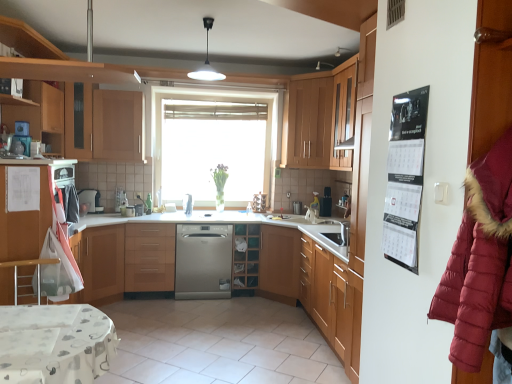
Question: From a real-world perspective, does satin silver dishwasher at center, the fourth appliance when ordered from back to front, stand above wooden cabinet at upper right, marked as the first cabinetry in a right-to-left arrangement?

Choices:
 (A) yes
 (B) no

Answer: (B)

Question: Would you say satin silver dishwasher at center, the first appliance viewed from the left, is a long distance from wooden cabinet at upper right, which appears as the fifth cabinetry when viewed from the left?

Choices:
 (A) no
 (B) yes

Answer: (B)

Question: Can you confirm if satin silver dishwasher at center, the first appliance viewed from the left, is taller than wooden cabinet at upper right, which appears as the fifth cabinetry when viewed from the left?

Choices:
 (A) no
 (B) yes

Answer: (A)

Question: Is satin silver dishwasher at center, which is counted as the 1th appliance, starting from the front, in contact with wooden cabinet at upper right, which appears as the fifth cabinetry when viewed from the left?

Choices:
 (A) no
 (B) yes

Answer: (A)

Question: Does satin silver dishwasher at center, the first appliance viewed from the left, have a smaller size compared to wooden cabinet at upper right, which appears as the fifth cabinetry when viewed from the left?

Choices:
 (A) no
 (B) yes

Answer: (B)

Question: Is satin silver dishwasher at center, which is counted as the 1th appliance, starting from the front, facing towards wooden cabinet at upper right, which appears as the fifth cabinetry when viewed from the left?

Choices:
 (A) no
 (B) yes

Answer: (B)

Question: Is metallic silver bar stool at lower left further to the viewer compared to wooden cabinet at upper center, which is the 2th cabinetry from right to left?

Choices:
 (A) no
 (B) yes

Answer: (A)

Question: Is metallic silver bar stool at lower left positioned before wooden cabinet at upper center, which is the 2th cabinetry from right to left?

Choices:
 (A) yes
 (B) no

Answer: (A)

Question: Would you say metallic silver bar stool at lower left is a long distance from wooden cabinet at upper center, the fourth cabinetry when ordered from left to right?

Choices:
 (A) no
 (B) yes

Answer: (B)

Question: From the image's perspective, is metallic silver bar stool at lower left below wooden cabinet at upper center, which is the 2th cabinetry from right to left?

Choices:
 (A) no
 (B) yes

Answer: (B)

Question: Is metallic silver bar stool at lower left wider than wooden cabinet at upper center, the fourth cabinetry when ordered from left to right?

Choices:
 (A) no
 (B) yes

Answer: (A)

Question: Is metallic silver bar stool at lower left aimed at wooden cabinet at upper center, which is the 2th cabinetry from right to left?

Choices:
 (A) yes
 (B) no

Answer: (B)

Question: Does wooden cabinet at upper center, the fourth cabinetry when ordered from left to right, contain satin silver dishwasher at center, the first appliance viewed from the left?

Choices:
 (A) yes
 (B) no

Answer: (B)